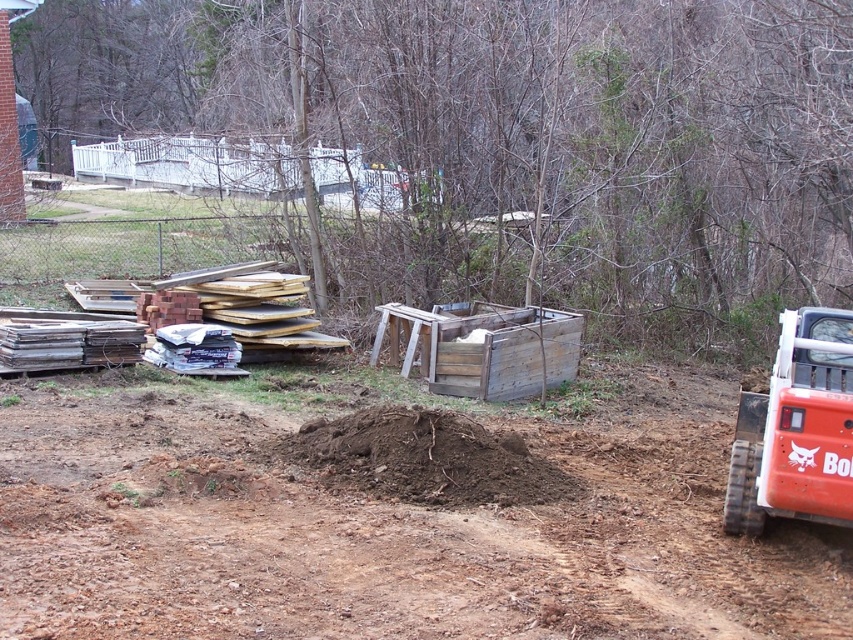
Between orange rubber track at right and weathered wood crate at center, which one appears on the left side from the viewer's perspective?

weathered wood crate at center

Which is above, orange rubber track at right or weathered wood crate at center?

Positioned higher is weathered wood crate at center.

The image size is (853, 640). What do you see at coordinates (796, 429) in the screenshot? I see `orange rubber track at right` at bounding box center [796, 429].

At what (x,y) coordinates should I click in order to perform the action: click on orange rubber track at right. Please return your answer as a coordinate pair (x, y). Looking at the image, I should click on (796, 429).

Where is `brown soil at lower right`? The width and height of the screenshot is (853, 640). brown soil at lower right is located at coordinates (383, 528).

Who is more distant from viewer, [70,625] or [485,477]?

Point [485,477]

Find the location of a particular element. The width and height of the screenshot is (853, 640). brown soil at lower right is located at coordinates (383, 528).

Describe the element at coordinates (796, 429) in the screenshot. The width and height of the screenshot is (853, 640). I see `orange rubber track at right` at that location.

Between orange rubber track at right and brown soil at center, which one appears on the right side from the viewer's perspective?

orange rubber track at right is more to the right.

At what (x,y) coordinates should I click in order to perform the action: click on orange rubber track at right. Please return your answer as a coordinate pair (x, y). This screenshot has width=853, height=640. Looking at the image, I should click on (796, 429).